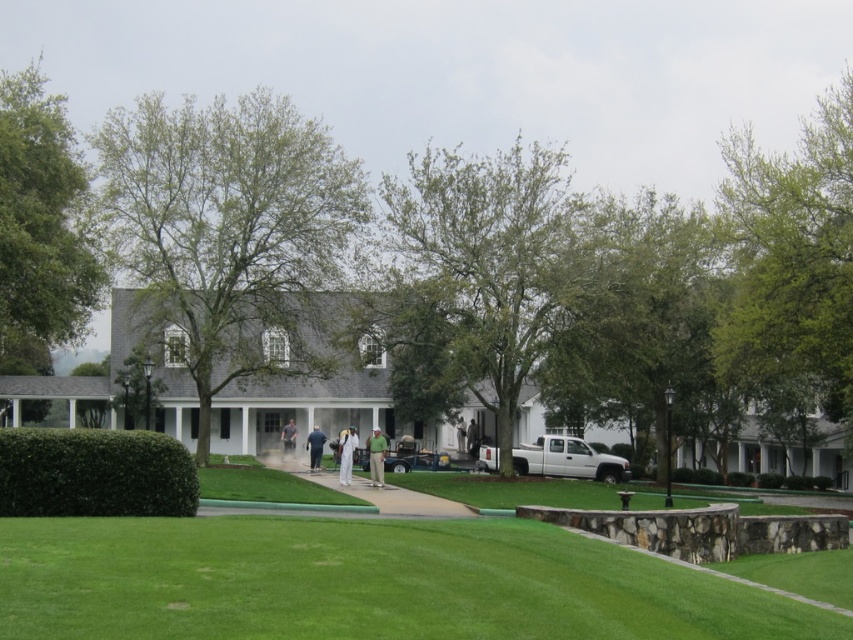
You are standing at the entrance of the building and want to reach both the white matte suit at center and the white matte pants at center. Which one is farther from your current position?

Both the white matte suit at center and the white matte pants at center are located at the same distance of 21.18 meters from your current position at the entrance.